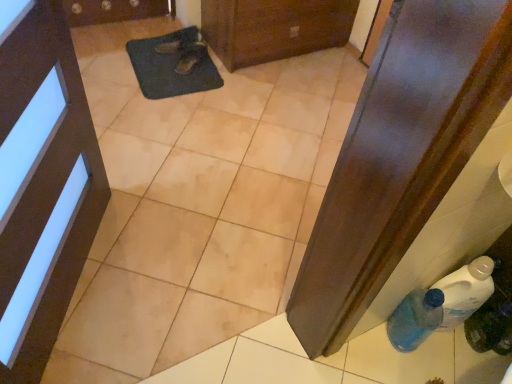
Question: Could you tell me if dark blue textured mat at center is facing blue translucent bottle at lower right, which ranks as the 1th bottle in left-to-right order?

Choices:
 (A) no
 (B) yes

Answer: (B)

Question: From the image's perspective, would you say dark blue textured mat at center is shown under blue translucent bottle at lower right, which ranks as the 1th bottle in left-to-right order?

Choices:
 (A) no
 (B) yes

Answer: (A)

Question: From the image's perspective, is dark blue textured mat at center on blue translucent bottle at lower right, which ranks as the 1th bottle in left-to-right order?

Choices:
 (A) yes
 (B) no

Answer: (A)

Question: Does dark blue textured mat at center come behind blue translucent bottle at lower right, which ranks as the 1th bottle in left-to-right order?

Choices:
 (A) no
 (B) yes

Answer: (B)

Question: Does dark blue textured mat at center have a greater height compared to blue translucent bottle at lower right, which ranks as the 1th bottle in left-to-right order?

Choices:
 (A) yes
 (B) no

Answer: (B)

Question: Is dark blue textured mat at center closer to camera compared to blue translucent bottle at lower right, which ranks as the 1th bottle in left-to-right order?

Choices:
 (A) no
 (B) yes

Answer: (A)

Question: Can you confirm if black leather shoe at upper center, positioned as the second footwear in bottom-to-top order, is positioned to the left of matte black door at upper left, positioned as the second door in right-to-left order?

Choices:
 (A) yes
 (B) no

Answer: (B)

Question: Does black leather shoe at upper center, which is counted as the first footwear, starting from the top, contain matte black door at upper left, which appears as the first door when viewed from the front?

Choices:
 (A) yes
 (B) no

Answer: (B)

Question: From a real-world perspective, does black leather shoe at upper center, which is counted as the first footwear, starting from the top, stand above matte black door at upper left, positioned as the second door in right-to-left order?

Choices:
 (A) yes
 (B) no

Answer: (B)

Question: Considering the relative sizes of black leather shoe at upper center, which is counted as the first footwear, starting from the top, and matte black door at upper left, arranged as the second door when viewed from the top, in the image provided, is black leather shoe at upper center, which is counted as the first footwear, starting from the top, bigger than matte black door at upper left, arranged as the second door when viewed from the top,?

Choices:
 (A) no
 (B) yes

Answer: (A)

Question: Can you confirm if black leather shoe at upper center, positioned as the second footwear in bottom-to-top order, is smaller than matte black door at upper left, positioned as the second door in right-to-left order?

Choices:
 (A) no
 (B) yes

Answer: (B)

Question: Considering the relative sizes of black leather shoe at upper center, positioned as the second footwear in bottom-to-top order, and matte black door at upper left, which is the first door from bottom to top, in the image provided, is black leather shoe at upper center, positioned as the second footwear in bottom-to-top order, thinner than matte black door at upper left, which is the first door from bottom to top,?

Choices:
 (A) no
 (B) yes

Answer: (A)

Question: Considering the relative positions of black leather shoe at upper center, which is counted as the first footwear, starting from the top, and blue translucent bottle at lower right, the 2th bottle positioned from the right, in the image provided, is black leather shoe at upper center, which is counted as the first footwear, starting from the top, to the left of blue translucent bottle at lower right, the 2th bottle positioned from the right, from the viewer's perspective?

Choices:
 (A) yes
 (B) no

Answer: (A)